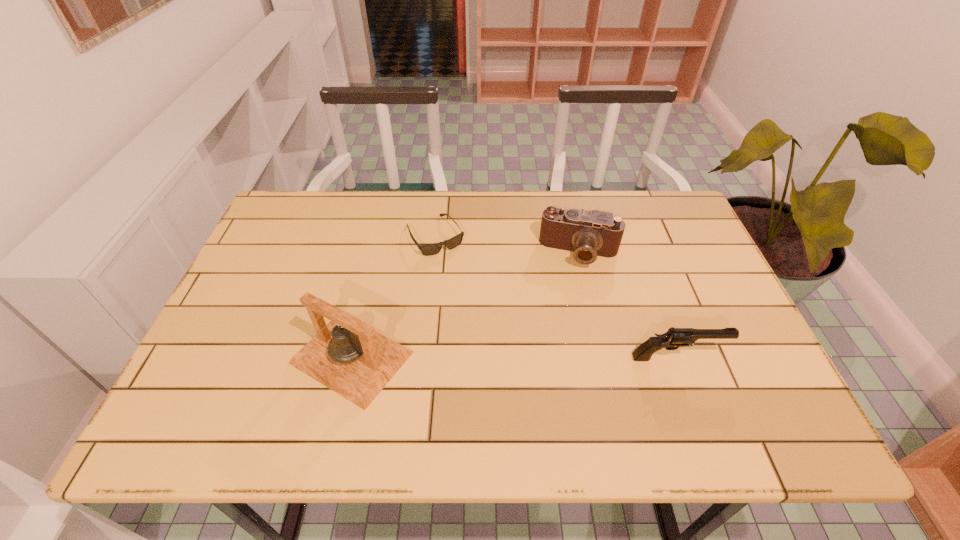
You are a GUI agent. You are given a task and a screenshot of the screen. Output one action in this format:
    pyautogui.click(x=<x>, y=<y>)
    Task: Click on the blank region between the camera and the shortest object
    The height and width of the screenshot is (540, 960).
    Given the screenshot: What is the action you would take?
    pyautogui.click(x=507, y=244)

Identify the location of free point between the tallest object and the sunglasses. This screenshot has height=540, width=960. (394, 297).

Image resolution: width=960 pixels, height=540 pixels. What are the coordinates of `unoccupied area between the sunglasses and the gun` in the screenshot? It's located at (556, 297).

In order to click on free space that is in between the bell and the sunglasses in this screenshot , I will do `click(394, 297)`.

Locate an element on the screen. The image size is (960, 540). vacant space in between the camera and the gun is located at coordinates (628, 305).

You are a GUI agent. You are given a task and a screenshot of the screen. Output one action in this format:
    pyautogui.click(x=<x>, y=<y>)
    Task: Click on the blank region between the camera and the sunglasses
    The height and width of the screenshot is (540, 960).
    Given the screenshot: What is the action you would take?
    pyautogui.click(x=507, y=244)

Find the location of a particular element. This screenshot has height=540, width=960. free space between the bell and the gun is located at coordinates (515, 357).

You are a GUI agent. You are given a task and a screenshot of the screen. Output one action in this format:
    pyautogui.click(x=<x>, y=<y>)
    Task: Click on the unoccupied position between the gun and the tallest object
    Image resolution: width=960 pixels, height=540 pixels.
    Given the screenshot: What is the action you would take?
    pyautogui.click(x=515, y=357)

The image size is (960, 540). I want to click on vacant region between the camera and the shortest object, so click(x=507, y=244).

You are a GUI agent. You are given a task and a screenshot of the screen. Output one action in this format:
    pyautogui.click(x=<x>, y=<y>)
    Task: Click on the blank region between the camera and the shortest object
    
    Given the screenshot: What is the action you would take?
    pyautogui.click(x=507, y=244)